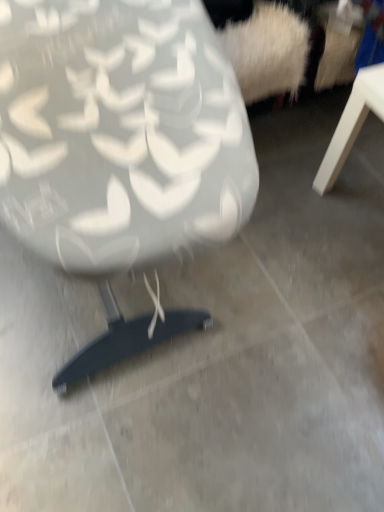
In order to click on matte white chair at center in this screenshot , I will do `click(119, 132)`.

The height and width of the screenshot is (512, 384). What do you see at coordinates (119, 132) in the screenshot?
I see `matte white chair at center` at bounding box center [119, 132].

The height and width of the screenshot is (512, 384). What are the coordinates of `white matte table at right` in the screenshot? It's located at (351, 124).

The image size is (384, 512). Describe the element at coordinates (351, 124) in the screenshot. I see `white matte table at right` at that location.

Where is `matte white chair at center`? Image resolution: width=384 pixels, height=512 pixels. matte white chair at center is located at coordinates (119, 132).

Considering the relative positions of white matte table at right and matte white chair at center in the image provided, is white matte table at right to the left of matte white chair at center from the viewer's perspective?

No, white matte table at right is not to the left of matte white chair at center.

Which is behind, white matte table at right or matte white chair at center?

Positioned behind is white matte table at right.

Which is in front, point (332, 162) or point (184, 198)?

Positioned in front is point (184, 198).

From the image's perspective, which one is positioned lower, white matte table at right or matte white chair at center?

white matte table at right, from the image's perspective.

From a real-world perspective, between white matte table at right and matte white chair at center, who is vertically lower?

From a 3D spatial view, white matte table at right is below.

Is white matte table at right wider than matte white chair at center?

In fact, white matte table at right might be narrower than matte white chair at center.

Between white matte table at right and matte white chair at center, which one has more height?

matte white chair at center.

Can you confirm if white matte table at right is bigger than matte white chair at center?

No, white matte table at right is not bigger than matte white chair at center.

Is white matte table at right not inside matte white chair at center?

Yes, white matte table at right is not within matte white chair at center.

Is white matte table at right positioned far away from matte white chair at center?

Actually, white matte table at right and matte white chair at center are a little close together.

Is white matte table at right oriented towards matte white chair at center?

Yes.

What's the angular difference between white matte table at right and matte white chair at center's facing directions?

The angle between the facing direction of white matte table at right and the facing direction of matte white chair at center is 91.8 degrees.

Where is `table that is on the right side of matte white chair at center`? table that is on the right side of matte white chair at center is located at coordinates (351, 124).

In the scene shown: Which is more to the left, matte white chair at center or white matte table at right?

matte white chair at center.

Is matte white chair at center in front of or behind white matte table at right in the image?

Clearly, matte white chair at center is in front of white matte table at right.

Considering the points (164, 101) and (349, 149), which point is behind, point (164, 101) or point (349, 149)?

The point (349, 149) is farther.

From the image's perspective, between matte white chair at center and white matte table at right, who is located below?

white matte table at right, from the image's perspective.

From a real-world perspective, is matte white chair at center over white matte table at right?

Yes.

Between matte white chair at center and white matte table at right, which one has larger width?

matte white chair at center is wider.

Can you confirm if matte white chair at center is shorter than white matte table at right?

In fact, matte white chair at center may be taller than white matte table at right.

Between matte white chair at center and white matte table at right, which one has larger size?

matte white chair at center.

Is white matte table at right located within matte white chair at center?

No, white matte table at right is not inside matte white chair at center.

Are matte white chair at center and white matte table at right making contact?

No, matte white chair at center is not next to white matte table at right.

Is matte white chair at center looking in the opposite direction of white matte table at right?

No, white matte table at right is not at the back of matte white chair at center.

Looking at this image, what's the angular difference between matte white chair at center and white matte table at right's facing directions?

They differ by 91.8 degrees in their facing directions.

Image resolution: width=384 pixels, height=512 pixels. In order to click on table beneath the matte white chair at center (from a real-world perspective) in this screenshot , I will do `click(351, 124)`.

Locate an element on the screen. chair on the left of the white matte table at right is located at coordinates (119, 132).

At what (x,y) coordinates should I click in order to perform the action: click on table behind the matte white chair at center. Please return your answer as a coordinate pair (x, y). Looking at the image, I should click on (351, 124).